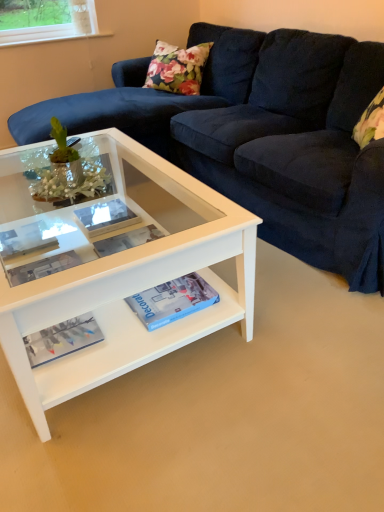
Locate an element on the screen. This screenshot has width=384, height=512. blank space above matte blue magazine at lower left (from a real-world perspective) is located at coordinates (62, 335).